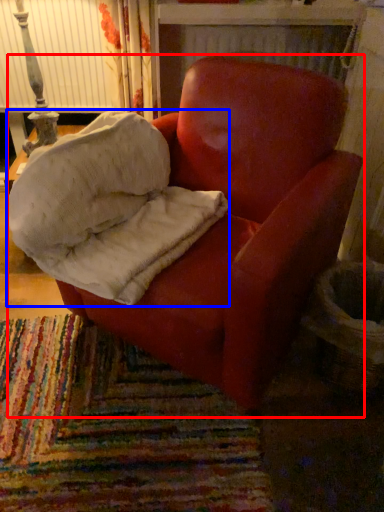
Question: Which object is further to the camera taking this photo, chair (highlighted by a red box) or material (highlighted by a blue box)?

Choices:
 (A) chair
 (B) material

Answer: (B)